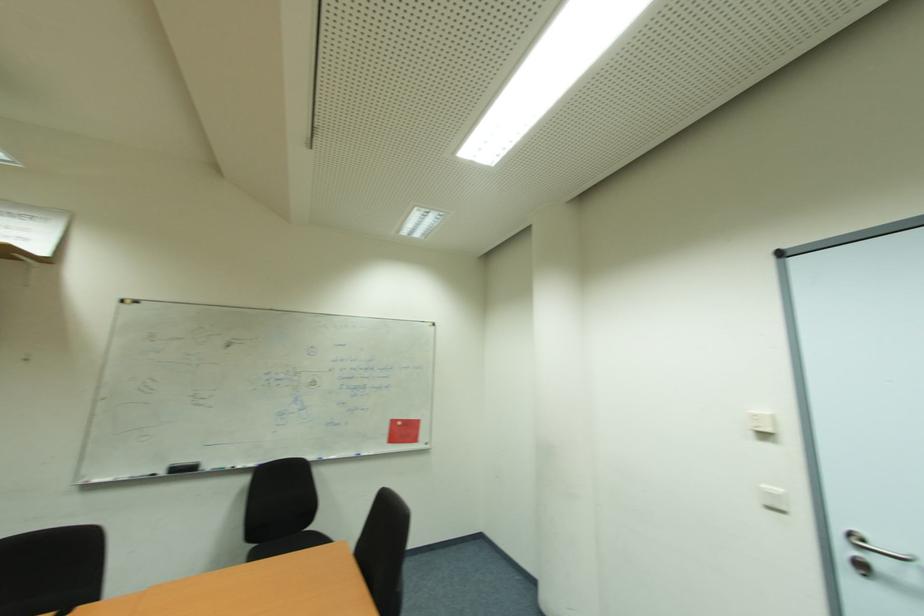
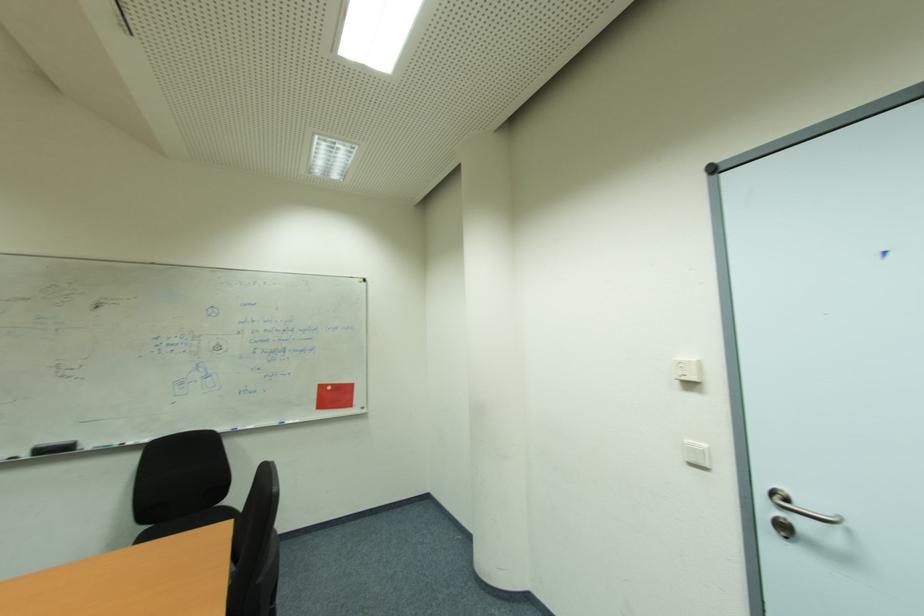
Question: The images are taken continuously from a first-person perspective. In which direction is your viewpoint rotating?

Choices:
 (A) Left
 (B) Right
 (C) Up
 (D) Down

Answer: (D)